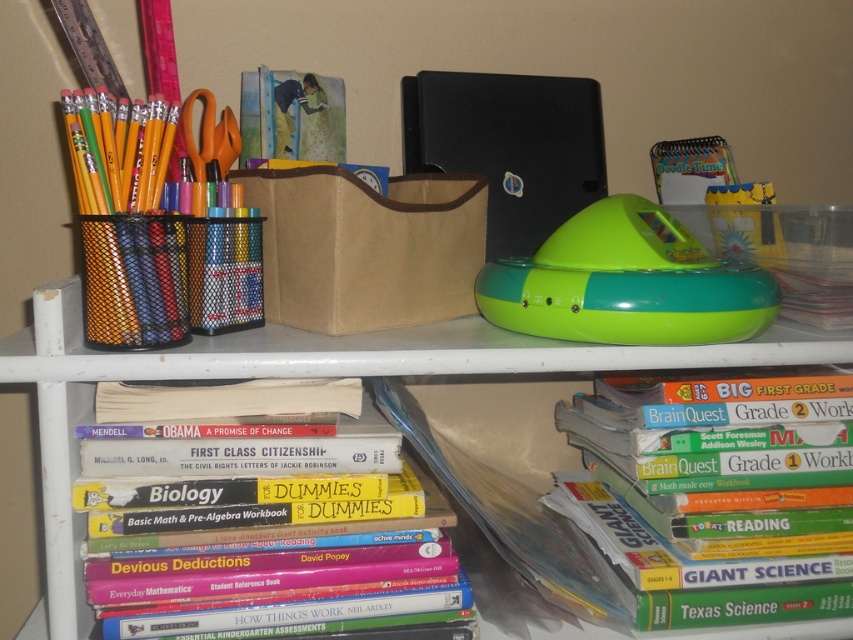
Is yellow paperback book at center to the right of green plastic toy at center from the viewer's perspective?

Incorrect, yellow paperback book at center is not on the right side of green plastic toy at center.

Who is more forward, (x=326, y=624) or (x=676, y=246)?

Positioned in front is point (x=326, y=624).

This screenshot has height=640, width=853. In order to click on yellow paperback book at center in this screenshot , I will do `click(283, 566)`.

Image resolution: width=853 pixels, height=640 pixels. What do you see at coordinates (343, 374) in the screenshot?
I see `green plastic speaker at upper center` at bounding box center [343, 374].

Between point (799, 348) and point (437, 515), which one is positioned behind?

The point (799, 348) is behind.

What do you see at coordinates (343, 374) in the screenshot? Image resolution: width=853 pixels, height=640 pixels. I see `green plastic speaker at upper center` at bounding box center [343, 374].

The image size is (853, 640). What are the coordinates of `green plastic speaker at upper center` in the screenshot? It's located at (343, 374).

This screenshot has width=853, height=640. What do you see at coordinates (343, 374) in the screenshot?
I see `green plastic speaker at upper center` at bounding box center [343, 374].

Is green plastic speaker at upper center positioned behind green plastic toy at center?

No, green plastic speaker at upper center is closer to the viewer.

Does point (759, 355) lie in front of point (747, 304)?

That is False.

Find the location of a particular element. green plastic speaker at upper center is located at coordinates (343, 374).